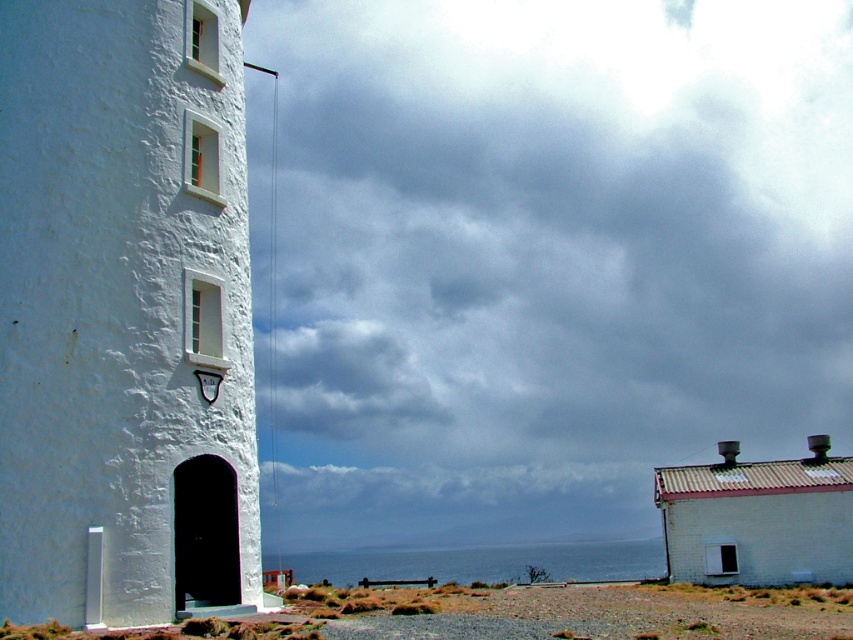
Does point (306, 84) come closer to viewer compared to point (68, 532)?

No, it is behind (68, 532).

Is point (563, 296) farther from camera compared to point (142, 81)?

That is True.

Locate an element on the screen. The width and height of the screenshot is (853, 640). cloudy sky at upper center is located at coordinates (550, 257).